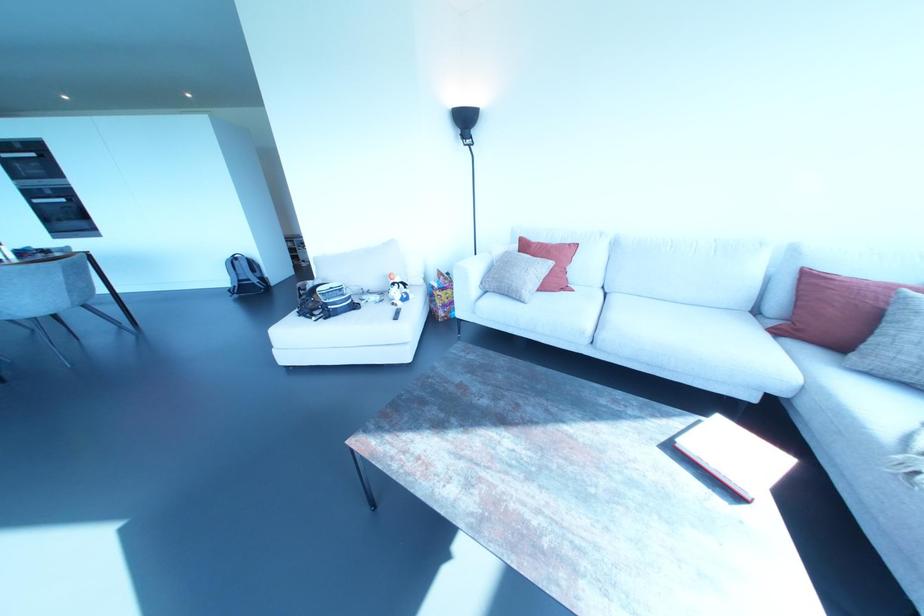
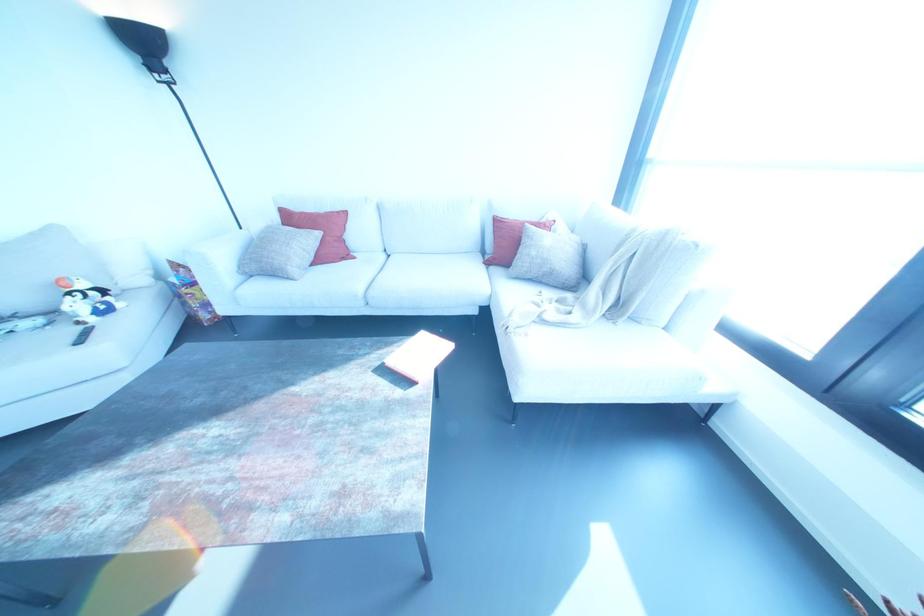
Question: The images are taken continuously from a first-person perspective. In which direction is your viewpoint rotating?

Choices:
 (A) Left
 (B) Right
 (C) Up
 (D) Down

Answer: (B)